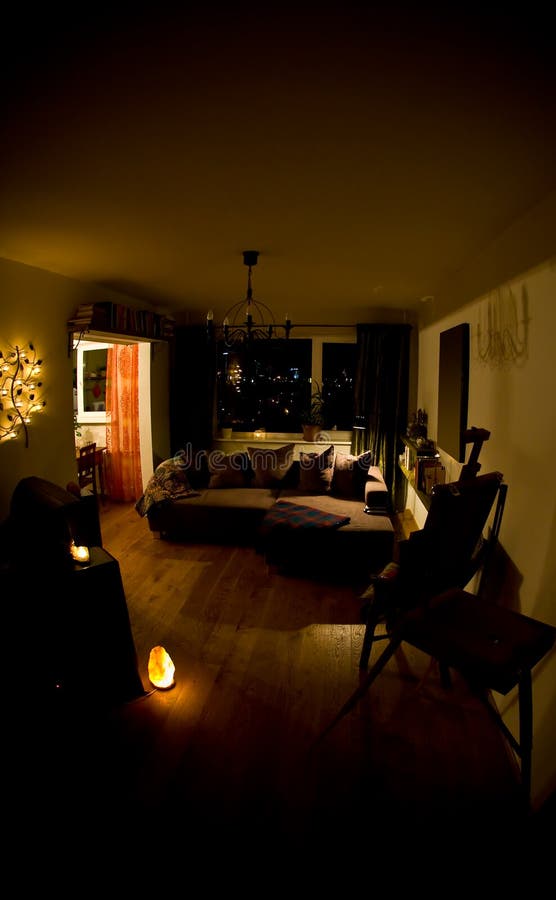
Identify the location of throw blanket. The height and width of the screenshot is (900, 556). (299, 513).